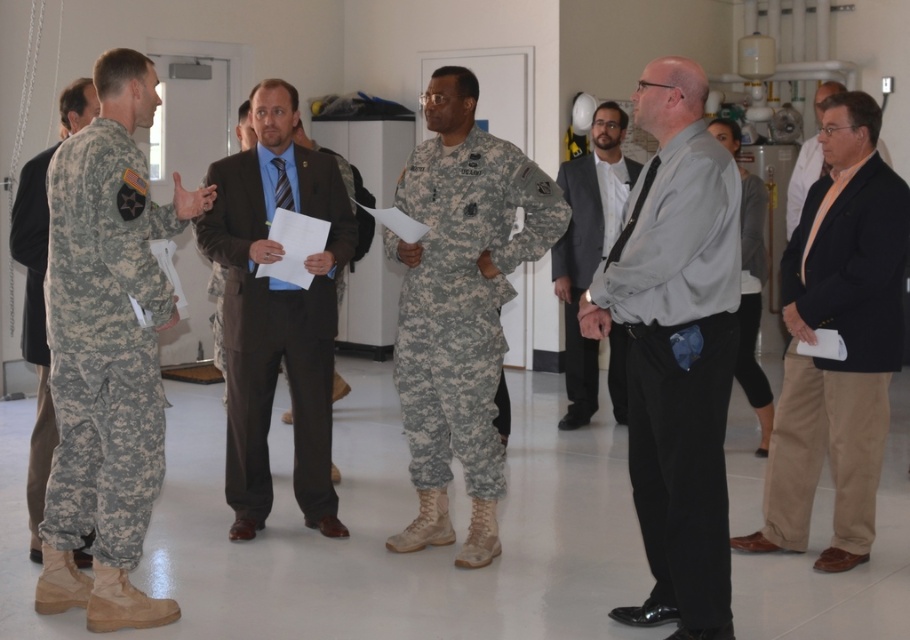
Image resolution: width=910 pixels, height=640 pixels. Describe the element at coordinates (34, 326) in the screenshot. I see `camouflage fabric pants at left` at that location.

How far apart are camouflage fabric pants at left and white matte shirt at center?

camouflage fabric pants at left is 4.79 meters away from white matte shirt at center.

Locate an element on the screen. The image size is (910, 640). camouflage fabric pants at left is located at coordinates (34, 326).

Does brown suit at center have a greater height compared to camouflage fabric pants at left?

In fact, brown suit at center may be shorter than camouflage fabric pants at left.

Is point (314, 461) closer to camera compared to point (83, 125)?

That is False.

Locate an element on the screen. Image resolution: width=910 pixels, height=640 pixels. brown suit at center is located at coordinates (276, 310).

Is camouflage fabric uniform at left below camouflage fabric pants at left?

Yes, camouflage fabric uniform at left is below camouflage fabric pants at left.

This screenshot has width=910, height=640. What do you see at coordinates (104, 342) in the screenshot?
I see `camouflage fabric uniform at left` at bounding box center [104, 342].

Where is `camouflage fabric uniform at left`? The height and width of the screenshot is (640, 910). camouflage fabric uniform at left is located at coordinates (104, 342).